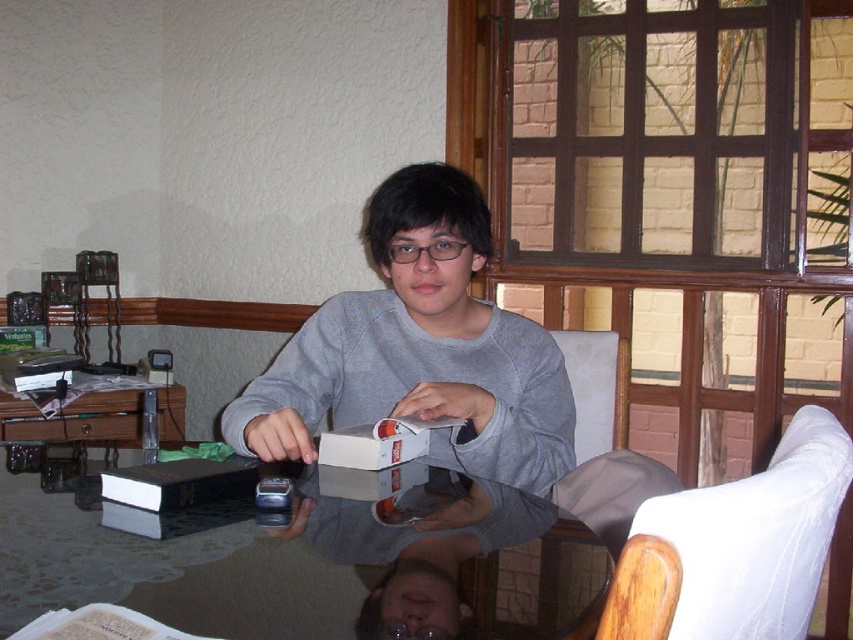
Does point (550, 332) come closer to viewer compared to point (659, 557)?

That is False.

Looking at this image, does white fabric armchair at center have a lesser height compared to wooden chair at lower right?

No.

Is point (564, 336) positioned after point (610, 634)?

Yes, it is.

Identify the location of white fabric armchair at center. The height and width of the screenshot is (640, 853). tap(596, 388).

Which of these two, transparent glass table at center or white fabric armchair at right, stands shorter?

With less height is transparent glass table at center.

Between point (310, 502) and point (788, 621), which one is positioned behind?

The point (310, 502) is behind.

Between point (409, 563) and point (721, 593), which one is positioned in front?

Positioned in front is point (721, 593).

Where is `transparent glass table at center`? The height and width of the screenshot is (640, 853). transparent glass table at center is located at coordinates (111, 561).

Who is lower down, gray matte shirt at center or black matte book at lower left?

black matte book at lower left is lower down.

Can you confirm if gray matte shirt at center is wider than black matte book at lower left?

Yes, gray matte shirt at center is wider than black matte book at lower left.

Is point (550, 442) positioned after point (195, 497)?

Yes.

The height and width of the screenshot is (640, 853). I want to click on gray matte shirt at center, so click(419, 348).